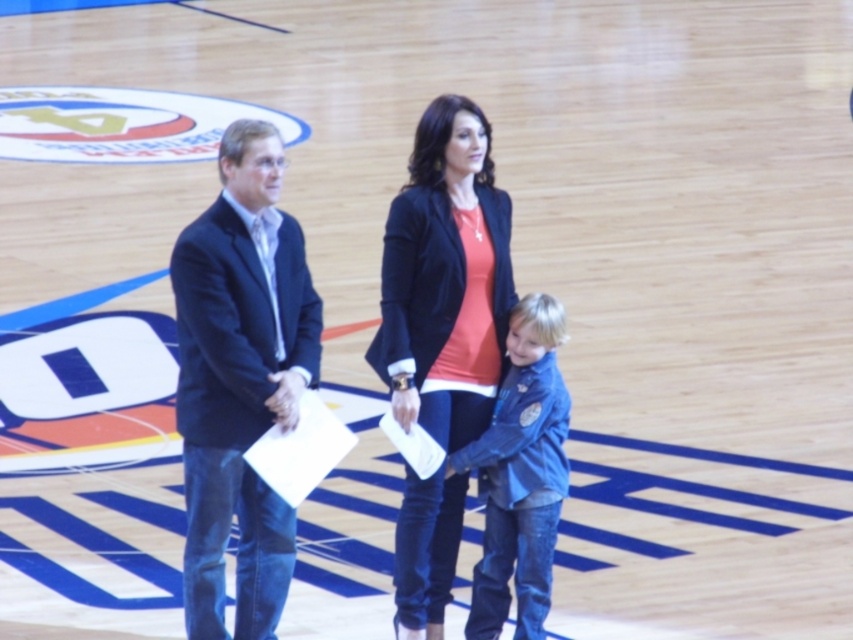
Based on the photo, you are a photographer setting up for an event on the basketball court. You need to position two subjects wearing the dark blue suit at left and velvet black blazer at center so that their sizes appear balanced in the photo. Which subject should you move closer to the camera and which should you move further away?

To balance their sizes in the photo, move the velvet black blazer at center closer to the camera and the dark blue suit at left further away. Since the dark blue suit at left is bigger, moving it further away will reduce its apparent size, while bringing the smaller velvet black blazer at center closer will make it appear larger, creating a more balanced composition.

You are a photographer positioned behind the dark blue suit at left and the velvet black blazer at center. You want to take a photo of the two people in the scene. Which person should you focus on first if you start from the left side of the frame?

You should focus on the dark blue suit at left first because it is positioned to the left of the velvet black blazer at center.

You are a photographer positioned at the back of the basketball court. You need to take a photo of both the dark blue suit at left and the blue denim jacket at center. Which person will appear larger in the photo?

The dark blue suit at left will appear larger in the photo because it is closer to the viewer than the blue denim jacket at center.